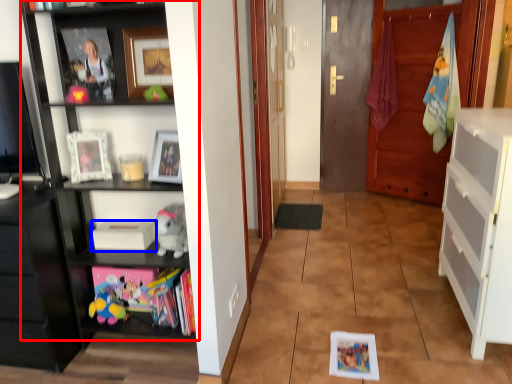
Question: Which of the following is the farthest to the observer, shelf (highlighted by a red box) or book (highlighted by a blue box)?

Choices:
 (A) shelf
 (B) book

Answer: (B)